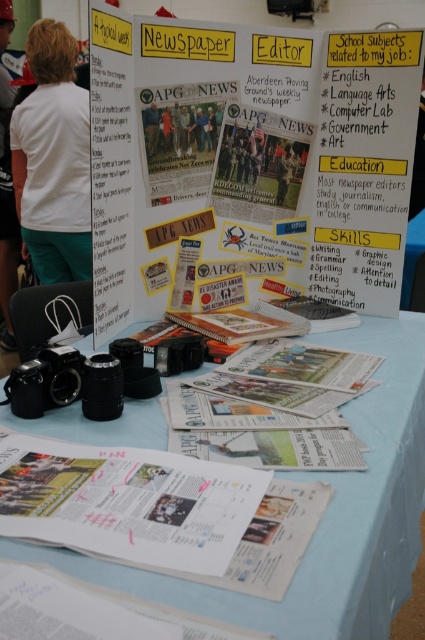
Does white glossy magazine at center appear over matte black camera at center?

No.

Who is positioned more to the right, white glossy magazine at center or matte black camera at center?

white glossy magazine at center

Who is more distant from viewer, (113, 529) or (153, 124)?

The point (153, 124) is behind.

In order to click on white glossy magazine at center in this screenshot , I will do `click(159, 512)`.

At what (x,y) coordinates should I click in order to perform the action: click on matte newspaper at center. Please return your answer as a coordinate pair (x, y). This screenshot has height=640, width=425. Looking at the image, I should click on (258, 164).

Which is in front, point (232, 211) or point (153, 125)?

Point (153, 125)

Image resolution: width=425 pixels, height=640 pixels. What are the coordinates of `matte newspaper at center` in the screenshot? It's located at (258, 164).

Is point (76, 166) positioned in front of point (152, 125)?

No, (76, 166) is behind (152, 125).

Which is behind, point (51, 145) or point (150, 122)?

The point (51, 145) is behind.

In order to click on white t-shirt at upper left in this screenshot , I will do `click(53, 160)`.